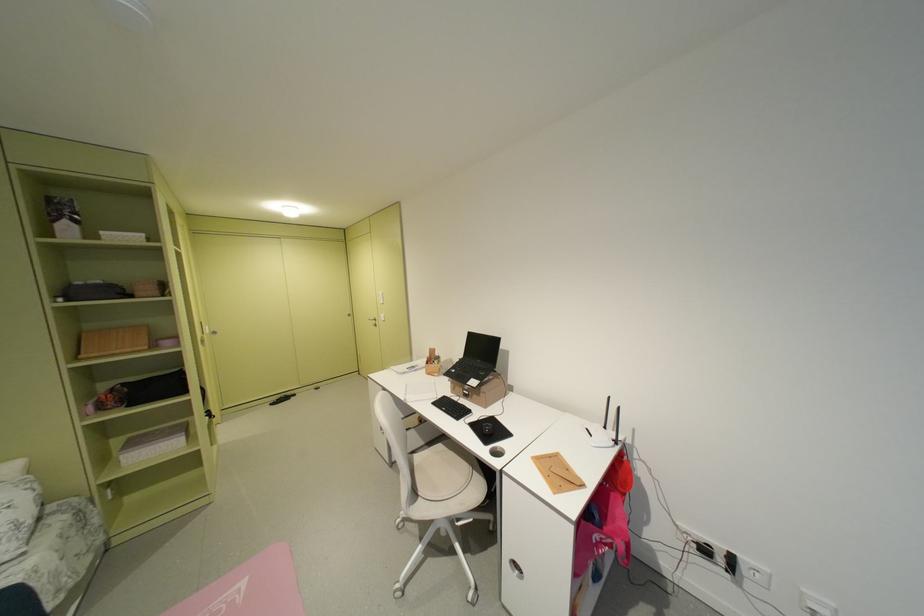
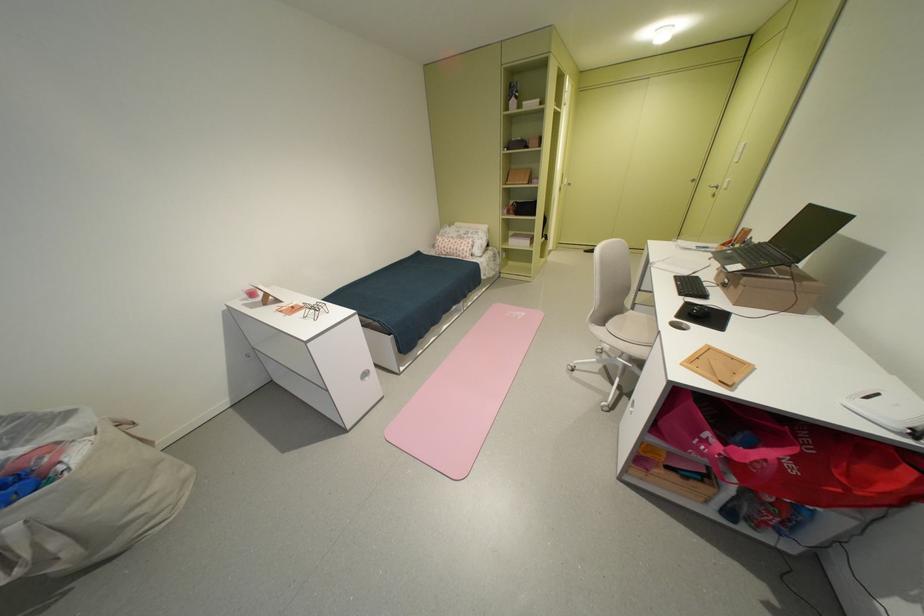
Where in the second image is the point corresponding to the point at 488,397 from the first image?

(746, 288)